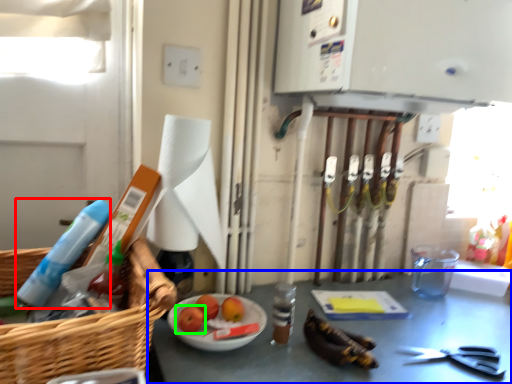
Question: Which object is the farthest from cleaning product (highlighted by a red box)? Choose among these: table (highlighted by a blue box) or fruit (highlighted by a green box).

Choices:
 (A) table
 (B) fruit

Answer: (A)